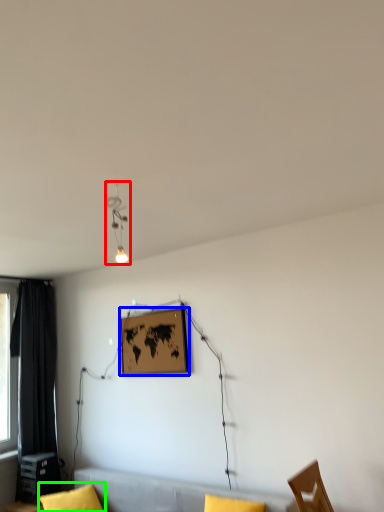
Question: Considering the real-world distances, which object is farthest from lamp (highlighted by a red box)? picture frame (highlighted by a blue box) or pillow (highlighted by a green box)?

Choices:
 (A) picture frame
 (B) pillow

Answer: (B)